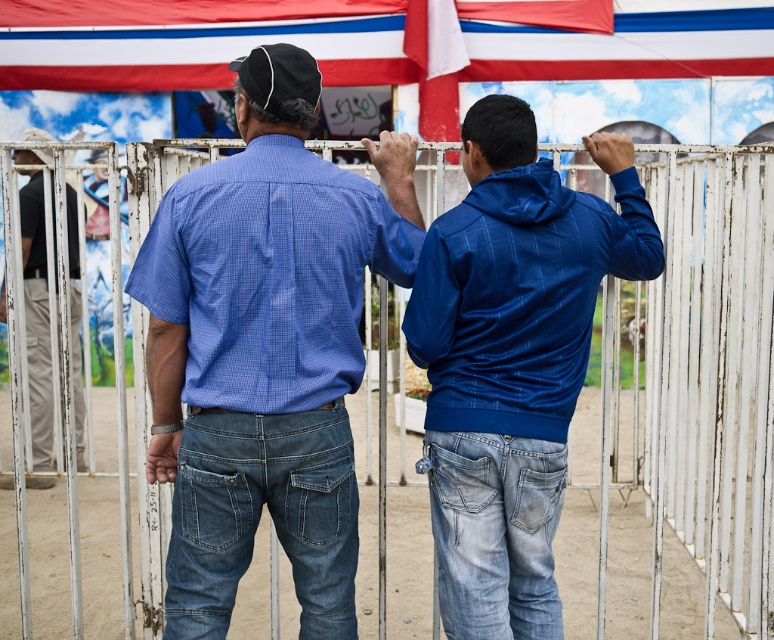
Question: Does blue pinstriped hoodie at center appear on the left side of black fabric baseball cap at upper center?

Choices:
 (A) yes
 (B) no

Answer: (B)

Question: Does matte blue shirt at center appear under khaki pants at left?

Choices:
 (A) yes
 (B) no

Answer: (A)

Question: Which point appears farthest from the camera in this image?

Choices:
 (A) (303, 253)
 (B) (269, 108)
 (C) (522, 339)

Answer: (C)

Question: Among these objects, which one is farthest from the camera?

Choices:
 (A) blue checkered shirt at center
 (B) khaki pants at left
 (C) blue pinstriped hoodie at center
 (D) black fabric baseball cap at upper center

Answer: (B)

Question: Based on their relative distances, which object is farther from the matte blue shirt at center?

Choices:
 (A) black fabric baseball cap at upper center
 (B) blue checkered shirt at center
 (C) khaki pants at left
 (D) blue pinstriped hoodie at center

Answer: (C)

Question: Does matte blue shirt at center appear on the right side of blue checkered shirt at center?

Choices:
 (A) no
 (B) yes

Answer: (A)